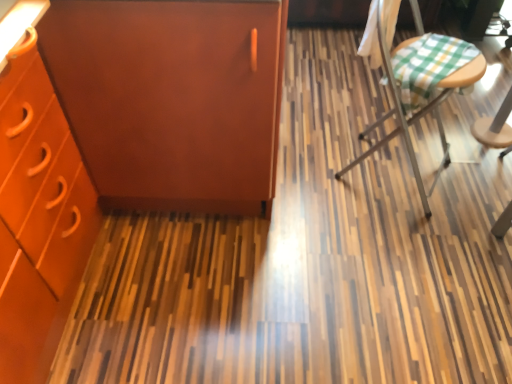
Where is `green checkered fabric at right`? The height and width of the screenshot is (384, 512). green checkered fabric at right is located at coordinates point(419,110).

What is the approximate height of matte orange cabinet at upper left?

matte orange cabinet at upper left is 36.03 inches in height.

This screenshot has width=512, height=384. Identify the location of matte brown cabinet at left. (170, 98).

From a real-world perspective, is green checkered fabric at right physically located above or below matte orange cabinet at upper left?

green checkered fabric at right is situated lower than matte orange cabinet at upper left in the real world.

Considering the relative sizes of green checkered fabric at right and matte orange cabinet at upper left in the image provided, is green checkered fabric at right shorter than matte orange cabinet at upper left?

Yes, green checkered fabric at right is shorter than matte orange cabinet at upper left.

Which is more to the right, green checkered fabric at right or matte orange cabinet at upper left?

Positioned to the right is green checkered fabric at right.

Based on the photo, from the image's perspective, is green checkered fabric at right below matte orange cabinet at upper left?

No, from the image's perspective, green checkered fabric at right is not beneath matte orange cabinet at upper left.

Is matte brown cabinet at left positioned before green checkered fabric at right?

That is True.

Is matte brown cabinet at left spatially inside green checkered fabric at right, or outside of it?

matte brown cabinet at left is outside green checkered fabric at right.

Between matte brown cabinet at left and green checkered fabric at right, which one has smaller width?

Thinner between the two is green checkered fabric at right.

Is matte brown cabinet at left oriented towards green checkered fabric at right?

No.

Is matte brown cabinet at left oriented towards matte orange cabinet at upper left?

Yes, matte brown cabinet at left is turned towards matte orange cabinet at upper left.

Would you say matte brown cabinet at left is inside or outside matte orange cabinet at upper left?

matte brown cabinet at left fits inside matte orange cabinet at upper left.

From a real-world perspective, relative to matte orange cabinet at upper left, is matte brown cabinet at left vertically above or below?

Clearly, from a real-world perspective, matte brown cabinet at left is below matte orange cabinet at upper left.

Considering the sizes of matte orange cabinet at upper left and matte brown cabinet at left in the image, is matte orange cabinet at upper left wider or thinner than matte brown cabinet at left?

In the image, matte orange cabinet at upper left appears to be wider than matte brown cabinet at left.

From the image's perspective, is matte orange cabinet at upper left on top of matte brown cabinet at left?

Actually, matte orange cabinet at upper left appears below matte brown cabinet at left in the image.

Looking at this image, can you tell me how much matte orange cabinet at upper left and matte brown cabinet at left differ in facing direction?

They differ by 89.4 degrees in their facing directions.

This screenshot has height=384, width=512. Identify the location of cabinetry in front of the matte brown cabinet at left. (124, 136).

Which object is wider, green checkered fabric at right or matte brown cabinet at left?

matte brown cabinet at left is wider.

Considering the positions of objects green checkered fabric at right and matte brown cabinet at left in the image provided, who is in front, green checkered fabric at right or matte brown cabinet at left?

matte brown cabinet at left is in front.

Is green checkered fabric at right to the left of matte brown cabinet at left from the viewer's perspective?

No, green checkered fabric at right is not to the left of matte brown cabinet at left.

Does green checkered fabric at right have a greater height compared to matte brown cabinet at left?

No, green checkered fabric at right is not taller than matte brown cabinet at left.

Is the depth of matte orange cabinet at upper left less than that of green checkered fabric at right?

Yes, it is.

Could you tell me if matte orange cabinet at upper left is turned towards green checkered fabric at right?

Yes, matte orange cabinet at upper left is facing green checkered fabric at right.

Looking at this image, from the image's perspective, between matte orange cabinet at upper left and green checkered fabric at right, which one is located above?

From the image's view, green checkered fabric at right is above.

Is matte orange cabinet at upper left directly adjacent to green checkered fabric at right?

matte orange cabinet at upper left is not next to green checkered fabric at right, and they're not touching.

Locate an element on the screen. chair behind the matte orange cabinet at upper left is located at coordinates (419, 110).

Where is `file cabinet that appears above the green checkered fabric at right (from a real-world perspective)`? This screenshot has height=384, width=512. file cabinet that appears above the green checkered fabric at right (from a real-world perspective) is located at coordinates (170, 98).

Estimate the real-world distances between objects in this image. Which object is further from matte brown cabinet at left, green checkered fabric at right or matte orange cabinet at upper left?

green checkered fabric at right is further to matte brown cabinet at left.

When comparing their distances from matte orange cabinet at upper left, does matte brown cabinet at left or green checkered fabric at right seem further?

Among the two, green checkered fabric at right is located further to matte orange cabinet at upper left.

Looking at the image, which one is located closer to matte orange cabinet at upper left, green checkered fabric at right or matte brown cabinet at left?

Among the two, matte brown cabinet at left is located nearer to matte orange cabinet at upper left.

Considering their positions, is matte orange cabinet at upper left positioned closer to matte brown cabinet at left than green checkered fabric at right?

matte orange cabinet at upper left lies closer to matte brown cabinet at left than the other object.

Looking at the image, which one is located further to green checkered fabric at right, matte orange cabinet at upper left or matte brown cabinet at left?

matte orange cabinet at upper left is positioned further to the anchor green checkered fabric at right.

In the scene shown: When comparing their distances from green checkered fabric at right, does matte brown cabinet at left or matte orange cabinet at upper left seem further?

matte orange cabinet at upper left is positioned further to the anchor green checkered fabric at right.

You are a GUI agent. You are given a task and a screenshot of the screen. Output one action in this format:
    pyautogui.click(x=<x>, y=<y>)
    Task: Click on the cabinetry between matte brown cabinet at left and green checkered fabric at right from left to right
    
    Given the screenshot: What is the action you would take?
    pyautogui.click(x=124, y=136)